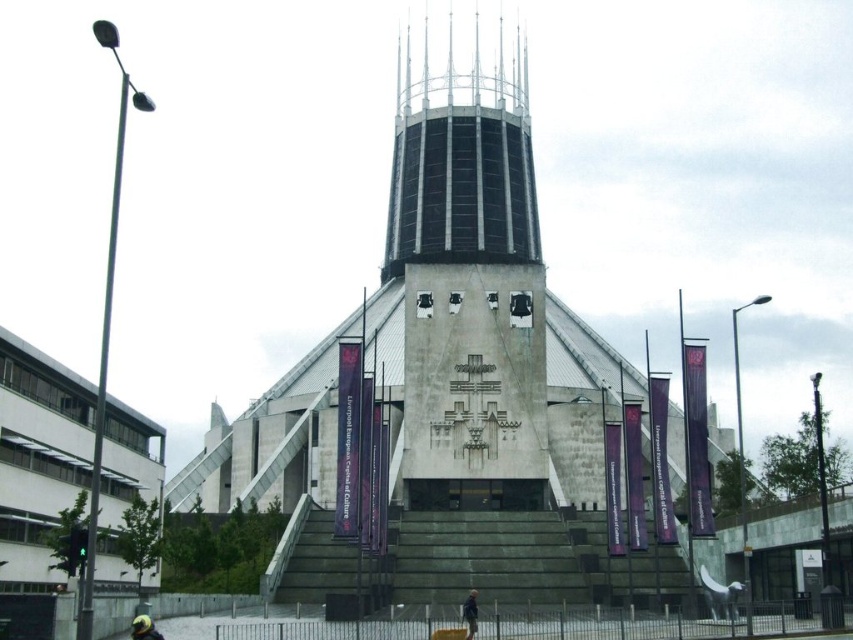
Can you confirm if dark gray concrete stairs at center is positioned to the right of yellow matte helmet at lower left?

Yes, dark gray concrete stairs at center is to the right of yellow matte helmet at lower left.

Between dark gray concrete stairs at center and yellow matte helmet at lower left, which one appears on the left side from the viewer's perspective?

yellow matte helmet at lower left is more to the left.

This screenshot has height=640, width=853. What do you see at coordinates (511, 557) in the screenshot? I see `dark gray concrete stairs at center` at bounding box center [511, 557].

I want to click on dark gray concrete stairs at center, so click(x=511, y=557).

Between black glass spire at center and yellow matte helmet at lower left, which one is positioned higher?

black glass spire at center

Between black glass spire at center and yellow matte helmet at lower left, which one appears on the right side from the viewer's perspective?

From the viewer's perspective, black glass spire at center appears more on the right side.

Locate an element on the screen. The height and width of the screenshot is (640, 853). black glass spire at center is located at coordinates (461, 160).

Is black glass spire at center above dark gray concrete stairs at center?

Correct, black glass spire at center is located above dark gray concrete stairs at center.

Who is lower down, black glass spire at center or dark gray concrete stairs at center?

dark gray concrete stairs at center is lower down.

Which is in front, point (401, 147) or point (664, 596)?

Point (664, 596) is in front.

This screenshot has width=853, height=640. I want to click on black glass spire at center, so click(x=461, y=160).